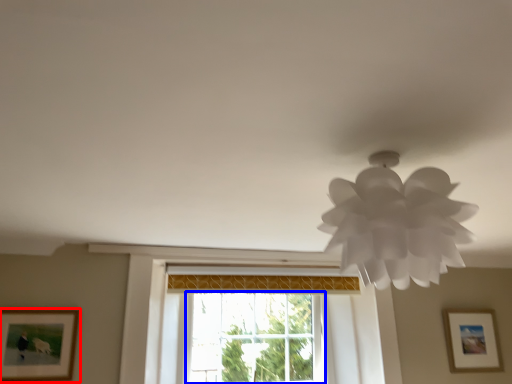
Question: Which of the following is the closest to the observer, picture frame (highlighted by a red box) or window (highlighted by a blue box)?

Choices:
 (A) picture frame
 (B) window

Answer: (A)